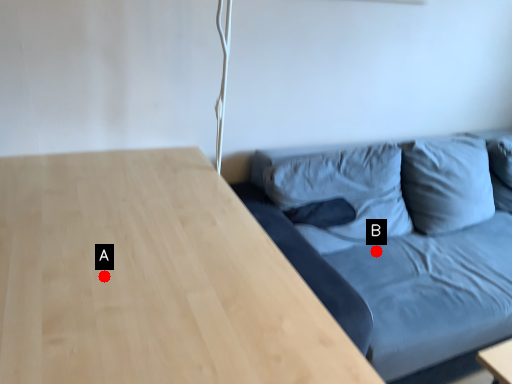
Question: Two points are circled on the image, labeled by A and B beside each circle. Which point is farther from the camera taking this photo?

Choices:
 (A) A is further
 (B) B is further

Answer: (B)